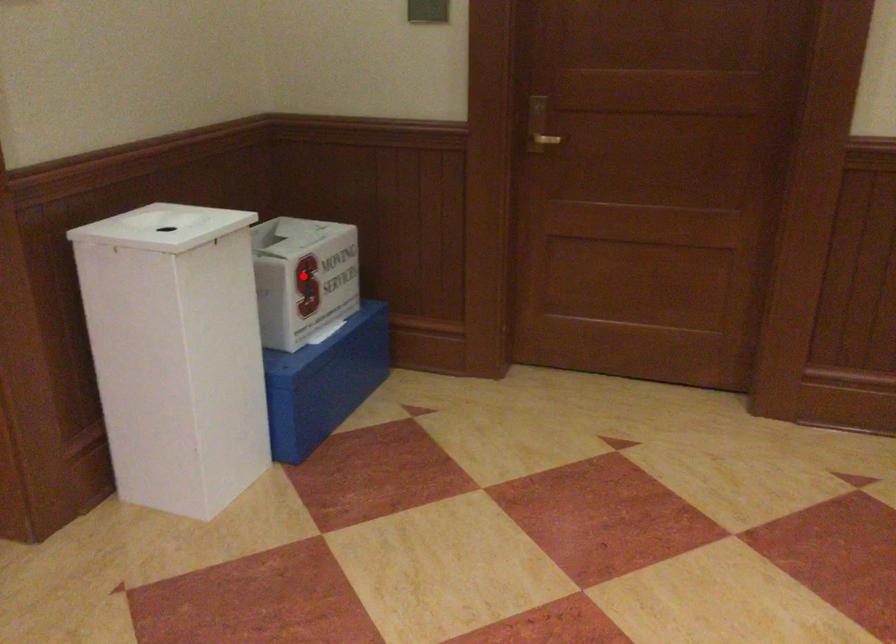
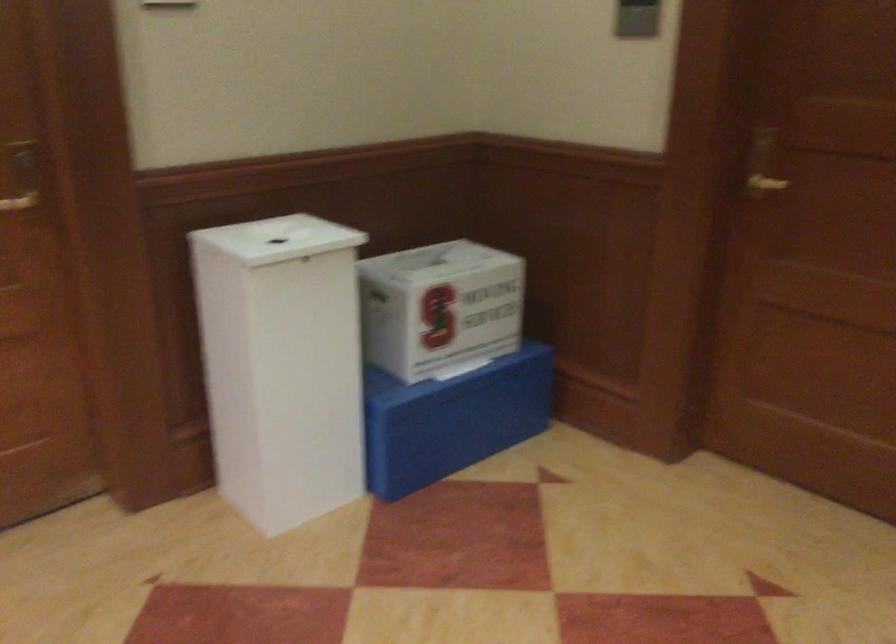
The point at the highlighted location is marked in the first image. Where is the corresponding point in the second image?

(440, 307)